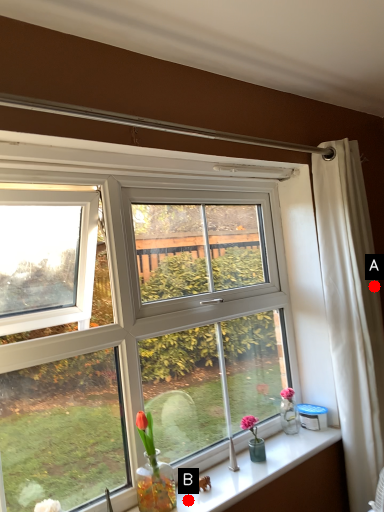
Question: Two points are circled on the image, labeled by A and B beside each circle. Which point is farther from the camera taking this photo?

Choices:
 (A) A is further
 (B) B is further

Answer: (A)